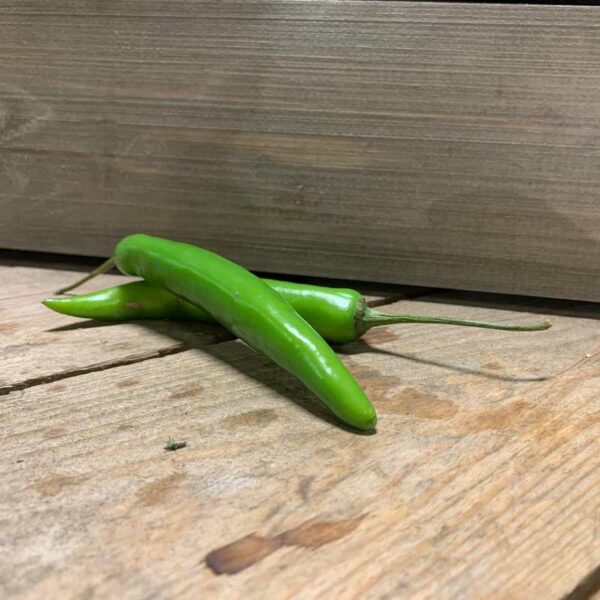
Where is `round spot in wall`? The height and width of the screenshot is (600, 600). round spot in wall is located at coordinates (309, 201).